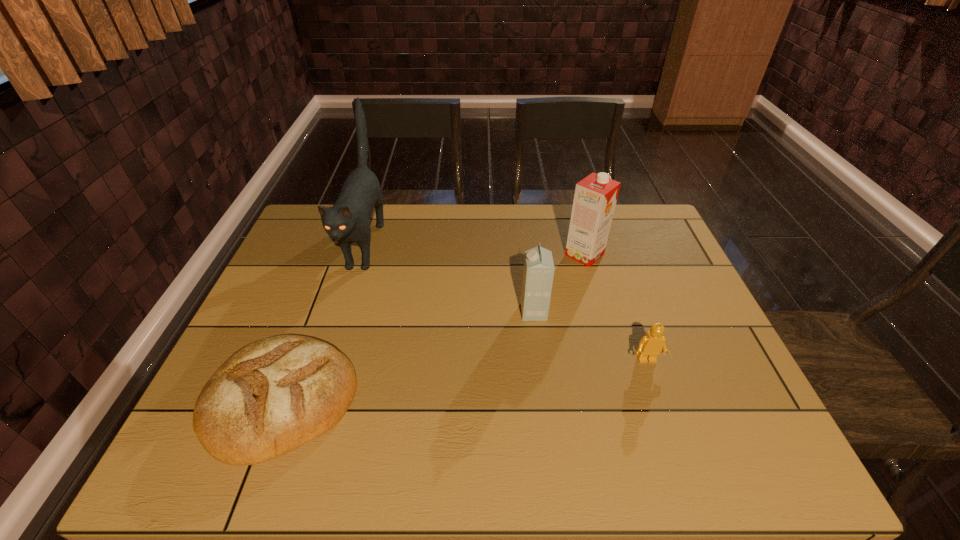
Locate an element on the screen. The width and height of the screenshot is (960, 540). free space at the far edge of the desktop is located at coordinates (416, 230).

This screenshot has height=540, width=960. I want to click on vacant space at the near edge of the desktop, so (x=302, y=465).

I want to click on vacant space at the left edge of the desktop, so click(306, 251).

Where is `free spot at the right edge of the desktop`? The image size is (960, 540). free spot at the right edge of the desktop is located at coordinates (710, 368).

Locate an element on the screen. blank space at the far right corner of the desktop is located at coordinates pyautogui.click(x=637, y=244).

Find the location of `vacant space at the near right corner of the desktop`. vacant space at the near right corner of the desktop is located at coordinates (726, 443).

Where is `free space between the cat and the fourth tallest object`? free space between the cat and the fourth tallest object is located at coordinates (506, 302).

At what (x,y) coordinates should I click in order to perform the action: click on free spot between the Lego and the tallest object. Please return your answer as a coordinate pair (x, y). Looking at the image, I should click on (506, 302).

This screenshot has width=960, height=540. I want to click on free spot between the Lego and the taller carton, so click(615, 308).

This screenshot has height=540, width=960. I want to click on free space between the tallest object and the second shortest object, so click(x=506, y=302).